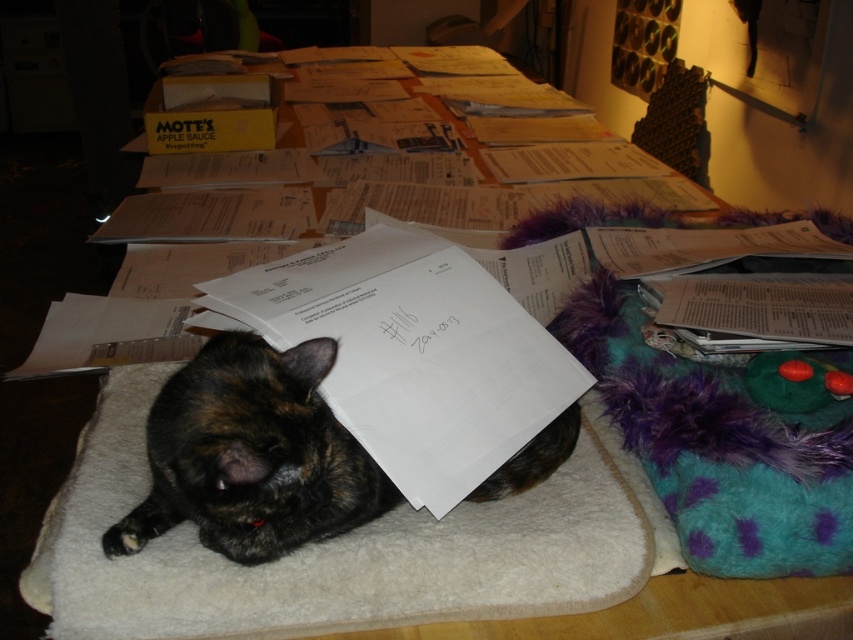
You are organizing the papers on the table and need to place a new document between the white paper at center and the tortoiseshell fur cat at center. How much space do you have to work with?

The white paper at center and the tortoiseshell fur cat at center are 10.97 centimeters apart, so you have 10.97 centimeters of space to place the new document between them.

You are organizing the papers on the table and need to retrieve the white paper at center. The tortoiseshell fur cat at center is in the way. To reach the paper, should you move the cat forward or backward?

The tortoiseshell fur cat at center is behind the white paper at center, so to reach the white paper at center, you should move the cat backward away from the paper.

What is located at the coordinates point (410,353) on the table?

At point (410,353) lies white paper at center.